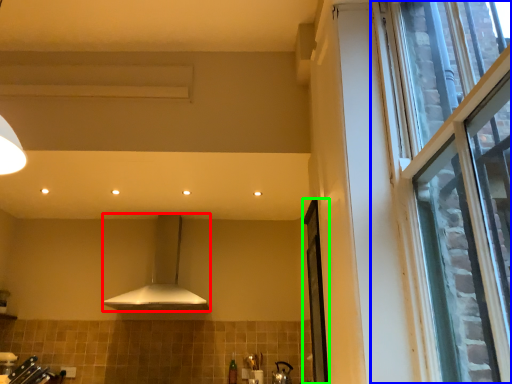
Question: Based on their relative distances, which object is farther from kitchen appliance (highlighted by a red box)? Choose from window (highlighted by a blue box) and screen door (highlighted by a green box).

Choices:
 (A) window
 (B) screen door

Answer: (A)